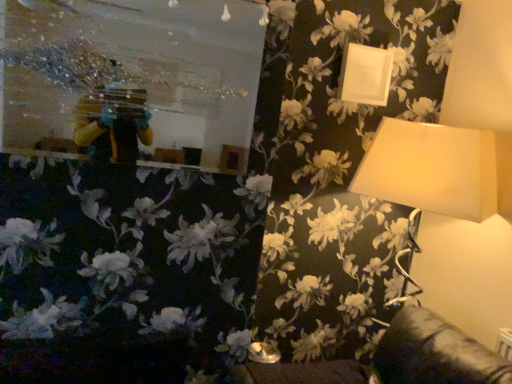
Question: Is white matte picture frame at upper right taller than metallic reflective mirror at upper left?

Choices:
 (A) yes
 (B) no

Answer: (B)

Question: Is the position of white matte picture frame at upper right more distant than that of metallic reflective mirror at upper left?

Choices:
 (A) yes
 (B) no

Answer: (A)

Question: Is the position of white matte picture frame at upper right less distant than that of metallic reflective mirror at upper left?

Choices:
 (A) yes
 (B) no

Answer: (B)

Question: Is metallic reflective mirror at upper left inside white matte picture frame at upper right?

Choices:
 (A) no
 (B) yes

Answer: (A)

Question: Does white matte picture frame at upper right appear on the right side of metallic reflective mirror at upper left?

Choices:
 (A) no
 (B) yes

Answer: (B)

Question: Is white matte picture frame at upper right to the left of metallic reflective mirror at upper left from the viewer's perspective?

Choices:
 (A) no
 (B) yes

Answer: (A)

Question: From a real-world perspective, is metallic reflective mirror at upper left located beneath white matte picture frame at upper right?

Choices:
 (A) yes
 (B) no

Answer: (A)

Question: Does metallic reflective mirror at upper left lie behind white matte picture frame at upper right?

Choices:
 (A) yes
 (B) no

Answer: (B)

Question: Is metallic reflective mirror at upper left to the left of white matte picture frame at upper right from the viewer's perspective?

Choices:
 (A) yes
 (B) no

Answer: (A)

Question: Does metallic reflective mirror at upper left appear on the right side of white matte picture frame at upper right?

Choices:
 (A) no
 (B) yes

Answer: (A)

Question: Can you confirm if metallic reflective mirror at upper left is bigger than white matte picture frame at upper right?

Choices:
 (A) no
 (B) yes

Answer: (B)

Question: From the image's perspective, is metallic reflective mirror at upper left over white matte picture frame at upper right?

Choices:
 (A) yes
 (B) no

Answer: (B)

Question: Can you confirm if metallic reflective mirror at upper left is positioned to the left of matte white lampshade at upper right?

Choices:
 (A) no
 (B) yes

Answer: (B)